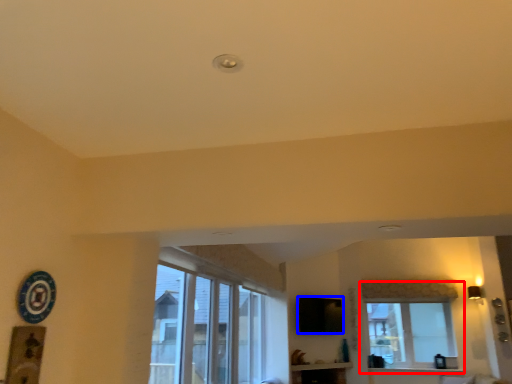
Question: Which object is further to the camera taking this photo, window (highlighted by a red box) or window screen (highlighted by a blue box)?

Choices:
 (A) window
 (B) window screen

Answer: (A)